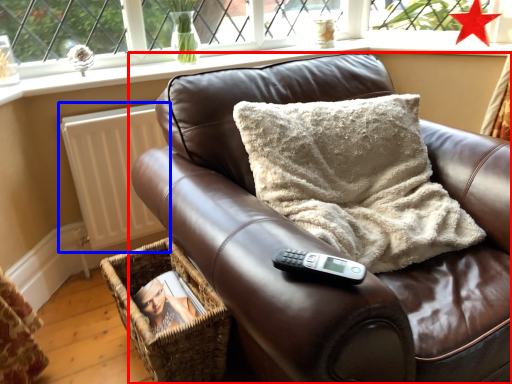
Question: Among these objects, which one is farthest to the camera, furniture (highlighted by a red box) or radiator (highlighted by a blue box)?

Choices:
 (A) furniture
 (B) radiator

Answer: (B)